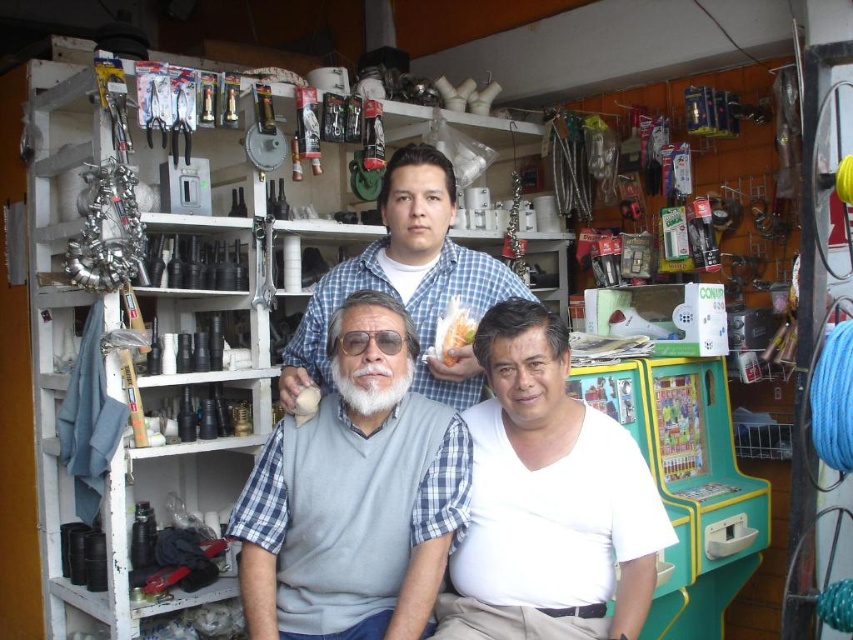
Is point (508, 637) farther from camera compared to point (395, 225)?

No.

Does white matte shirt at center have a lesser height compared to blue plaid shirt at center?

No, white matte shirt at center is not shorter than blue plaid shirt at center.

Between point (474, 502) and point (491, 257), which one is positioned behind?

Positioned behind is point (491, 257).

The height and width of the screenshot is (640, 853). Identify the location of white matte shirt at center. (548, 500).

Is gray matte vest at center thinner than blue plaid shirt at center?

Yes.

Is gray matte vest at center wider than blue plaid shirt at center?

No, gray matte vest at center is not wider than blue plaid shirt at center.

Between point (254, 600) and point (421, 150), which one is positioned in front?

Point (254, 600) is more forward.

Identify the location of gray matte vest at center. (354, 496).

Is point (393, 410) more distant than point (566, 545)?

That is True.

Between gray matte vest at center and white matte shirt at center, which one appears on the right side from the viewer's perspective?

Positioned to the right is white matte shirt at center.

Where is `gray matte vest at center`? This screenshot has height=640, width=853. gray matte vest at center is located at coordinates (354, 496).

Locate an element on the screen. Image resolution: width=853 pixels, height=640 pixels. gray matte vest at center is located at coordinates (354, 496).